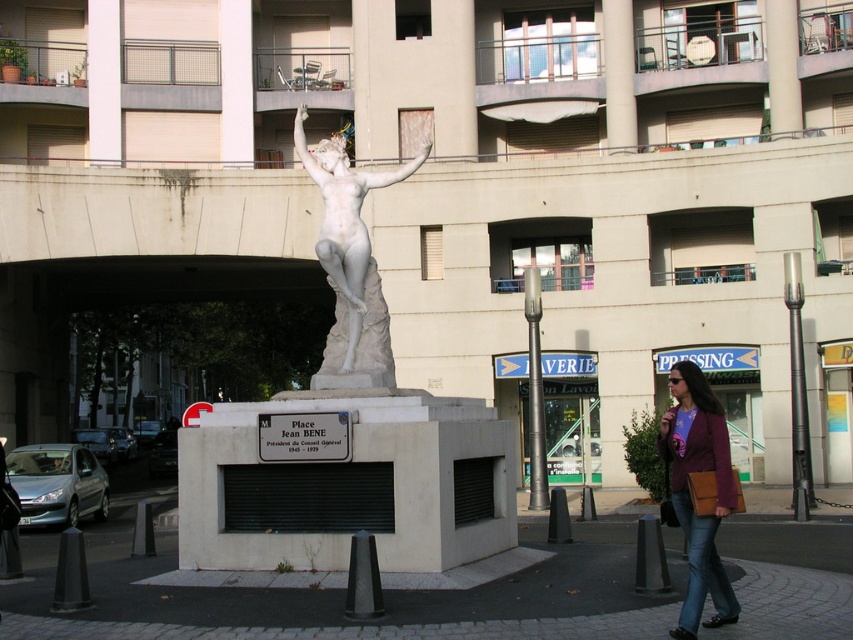
Question: Is purple leather jacket at lower right in front of white marble statue at center?

Choices:
 (A) yes
 (B) no

Answer: (A)

Question: Can you confirm if purple leather jacket at lower right is smaller than white marble statue at center?

Choices:
 (A) no
 (B) yes

Answer: (B)

Question: Which point appears farthest from the camera in this image?

Choices:
 (A) tap(724, 488)
 (B) tap(325, 268)

Answer: (B)

Question: Does purple leather jacket at lower right come behind white marble statue at center?

Choices:
 (A) no
 (B) yes

Answer: (A)